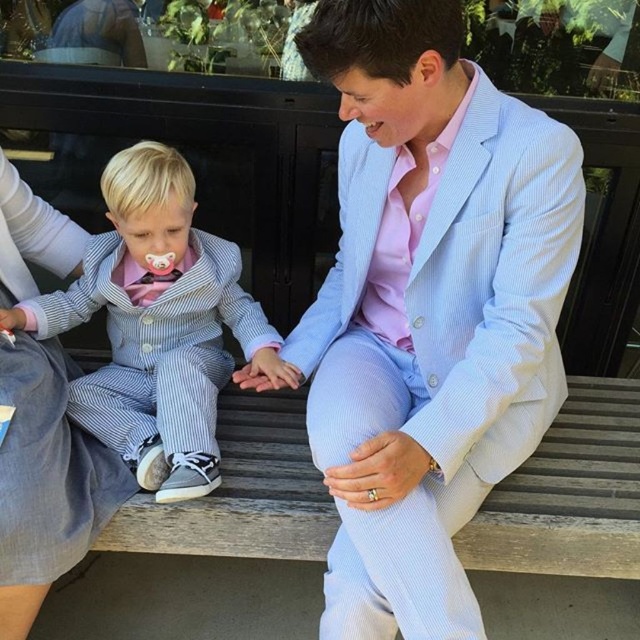
Between point (545, 262) and point (216, 248), which one is positioned in front?

Point (545, 262) is more forward.

Is light blue seersucker suit at center closer to the viewer compared to striped fabric suit at left?

That is True.

Between point (445, 314) and point (180, 332), which one is positioned behind?

Point (180, 332)

The image size is (640, 640). In order to click on light blue seersucker suit at center in this screenshot , I will do `click(428, 308)`.

Looking at this image, can you confirm if light blue seersucker suit at center is positioned below light blue striped suit at center?

Incorrect, light blue seersucker suit at center is not positioned below light blue striped suit at center.

Is light blue seersucker suit at center taller than light blue striped suit at center?

Yes, light blue seersucker suit at center is taller than light blue striped suit at center.

Does point (428, 92) lie behind point (49, 243)?

No.

I want to click on light blue seersucker suit at center, so click(x=428, y=308).

Can you confirm if striped fabric suit at left is thinner than light blue striped suit at center?

No.

Who is positioned more to the left, striped fabric suit at left or light blue striped suit at center?

From the viewer's perspective, light blue striped suit at center appears more on the left side.

Who is more distant from viewer, (211, 417) or (38, 387)?

Point (211, 417)

This screenshot has height=640, width=640. Identify the location of striped fabric suit at left. (x=157, y=324).